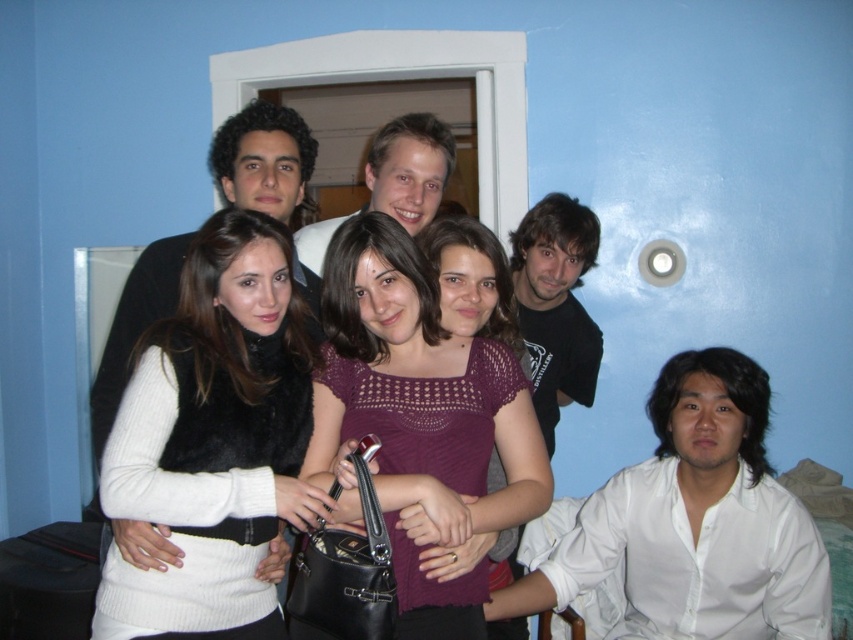
Question: Which is farther from the dark brown hair at center?

Choices:
 (A) crochet knit top at center
 (B) matte black shirt at center
 (C) purple knitted top at center
 (D) white fuzzy vest at center

Answer: (D)

Question: Is white fuzzy vest at center in front of dark brown hair at center?

Choices:
 (A) yes
 (B) no

Answer: (A)

Question: Does white fuzzy vest at center have a smaller size compared to white smooth shirt at lower right?

Choices:
 (A) yes
 (B) no

Answer: (A)

Question: Which point is closer to the camera taking this photo?

Choices:
 (A) (813, 554)
 (B) (544, 371)
 (C) (448, 128)
 (D) (233, 563)

Answer: (D)

Question: From the image, what is the correct spatial relationship of white fuzzy vest at center in relation to dark brown hair at center?

Choices:
 (A) above
 (B) below

Answer: (B)

Question: Which point appears farthest from the camera in this image?

Choices:
 (A) (548, 429)
 (B) (502, 545)
 (C) (396, 140)
 (D) (277, 442)

Answer: (A)